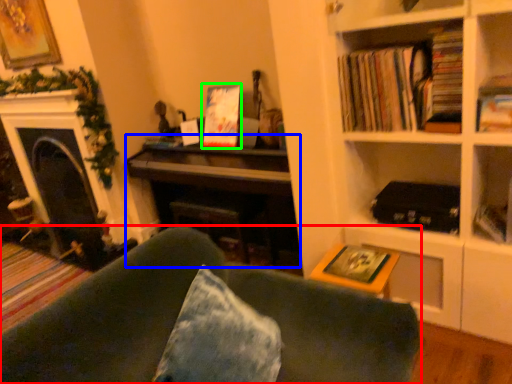
Question: Which object is the farthest from studio couch (highlighted by a red box)? Choose among these: piano (highlighted by a blue box) or paperback book (highlighted by a green box).

Choices:
 (A) piano
 (B) paperback book

Answer: (B)